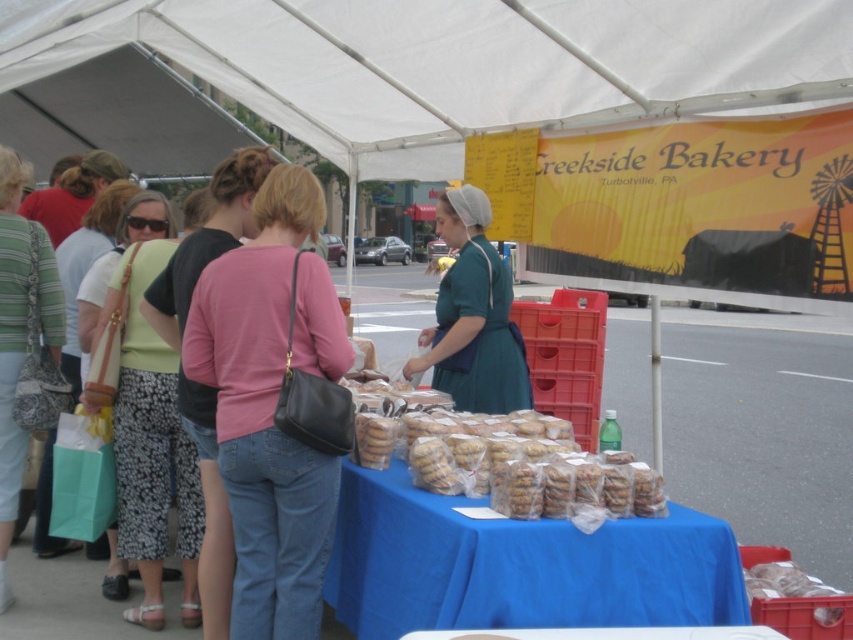
Question: Where is pink leather purse at center located in relation to translucent plastic cookies at center in the image?

Choices:
 (A) right
 (B) left

Answer: (B)

Question: Which object appears farthest from the camera in this image?

Choices:
 (A) light green fabric skirt at left
 (B) blue fabric tablecloth at lower center
 (C) pink leather purse at center
 (D) white fabric canopy at upper center

Answer: (A)

Question: Which object is positioned closest to the teal fabric dress at center?

Choices:
 (A) translucent plastic cookies at center
 (B) light green fabric skirt at left
 (C) blue fabric tablecloth at lower center

Answer: (A)

Question: Does pink leather purse at center lie behind light green fabric skirt at left?

Choices:
 (A) no
 (B) yes

Answer: (A)

Question: Which object is positioned closest to the teal fabric dress at center?

Choices:
 (A) white fabric canopy at upper center
 (B) light green fabric skirt at left
 (C) blue fabric tablecloth at lower center
 (D) pink leather purse at center

Answer: (C)

Question: Does blue fabric tablecloth at lower center come in front of translucent plastic cookies at center?

Choices:
 (A) yes
 (B) no

Answer: (A)